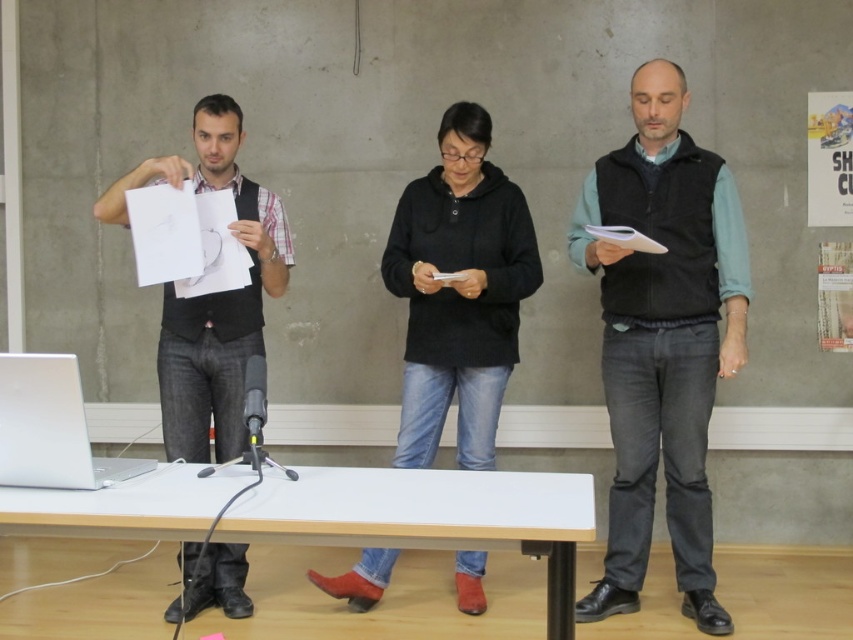
Question: Which point appears closest to the camera in this image?

Choices:
 (A) (26, 467)
 (B) (566, 496)
 (C) (485, 444)

Answer: (A)

Question: Which point is farther to the camera?

Choices:
 (A) (184, 164)
 (B) (556, 493)
 (C) (407, 198)

Answer: (C)

Question: Which is nearer to the white wood table at lower center?

Choices:
 (A) matte black vest at left
 (B) dark gray vest at center

Answer: (A)

Question: Can you confirm if dark gray vest at center is wider than matte black vest at left?

Choices:
 (A) yes
 (B) no

Answer: (B)

Question: Does white wood table at lower center appear on the right side of silver metallic laptop at lower left?

Choices:
 (A) yes
 (B) no

Answer: (A)

Question: Can you confirm if white wood table at lower center is wider than black matte jacket at center?

Choices:
 (A) yes
 (B) no

Answer: (A)